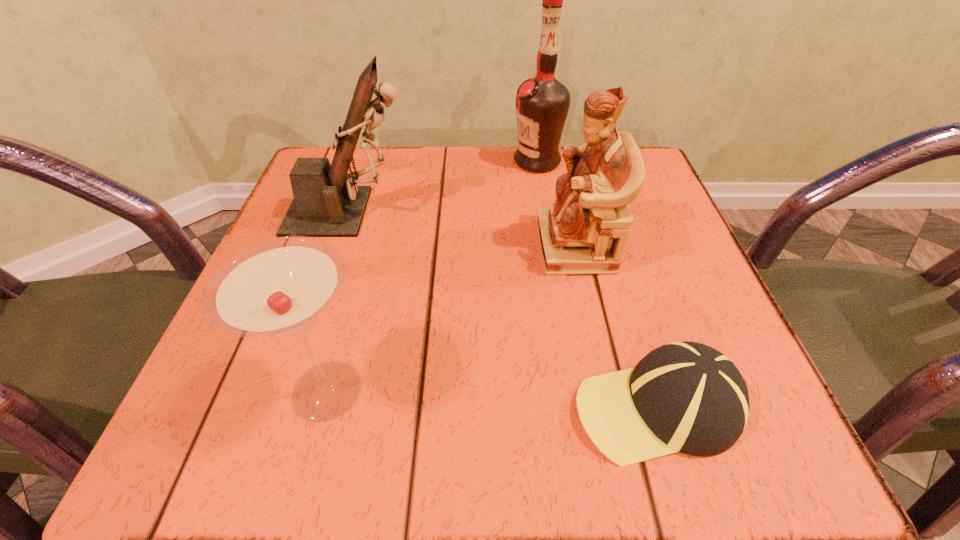
Locate an element on the screen. Image resolution: width=960 pixels, height=540 pixels. figurine located at the left edge is located at coordinates (327, 202).

What are the coordinates of `martini present at the left edge` in the screenshot? It's located at (279, 288).

Locate an element on the screen. figurine that is at the right edge is located at coordinates (585, 231).

Image resolution: width=960 pixels, height=540 pixels. Identify the location of baseball cap at the right edge. (687, 397).

The height and width of the screenshot is (540, 960). I want to click on object that is at the far left corner, so click(x=327, y=202).

Identify the location of object that is positioned at the near left corner. The height and width of the screenshot is (540, 960). coord(279,288).

You are a GUI agent. You are given a task and a screenshot of the screen. Output one action in this format:
    pyautogui.click(x=<x>, y=<y>)
    Task: Click on the object that is at the near right corner
    The width and height of the screenshot is (960, 540).
    Given the screenshot: What is the action you would take?
    pyautogui.click(x=687, y=397)

Image resolution: width=960 pixels, height=540 pixels. What are the coordinates of `free space at the far edge of the desktop` in the screenshot? It's located at (420, 154).

Locate an element on the screen. The image size is (960, 540). free region at the near edge of the desktop is located at coordinates point(487,435).

Locate an element on the screen. vacant region at the left edge of the desktop is located at coordinates (354, 278).